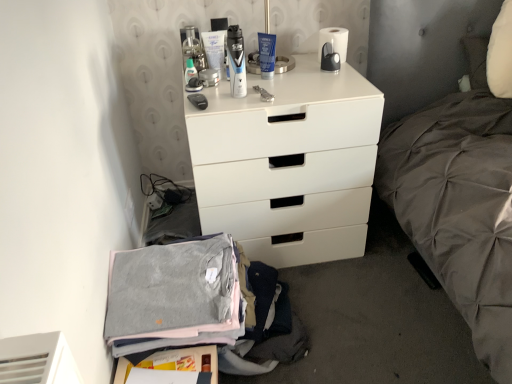
Where is `vacant space in front of white matte toilet paper at upper center`? Image resolution: width=512 pixels, height=384 pixels. vacant space in front of white matte toilet paper at upper center is located at coordinates (330, 77).